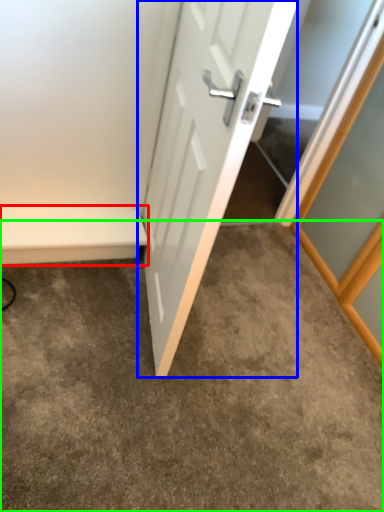
Question: Estimate the real-world distances between objects in this image. Which object is farther from balustrade (highlighted by a red box), door (highlighted by a blue box) or concrete (highlighted by a green box)?

Choices:
 (A) door
 (B) concrete

Answer: (A)